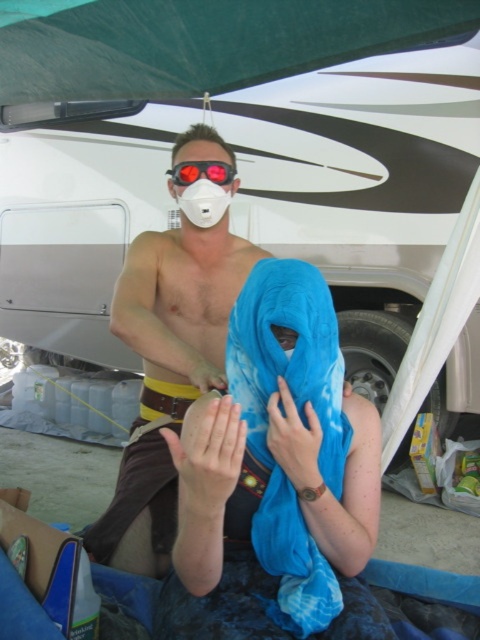
You are standing at the center of the image. Which direction should you move to get closer to the green fabric canopy at upper center?

Since the green fabric canopy at upper center is located at point 0.067 on the x and 0.421 on the y, moving towards the upper center direction would bring you closer to it.

You are standing at the origin point in the image. There are two points marked in the scene. Which point is closer to you, point (173, 195) or point (176, 164)?

Point (176, 164) is closer to you because it is in front of point (173, 195).